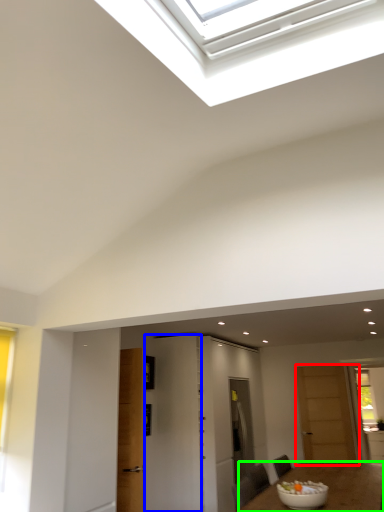
Question: Which object is the closest to the door (highlighted by a red box)? Choose among these: door (highlighted by a blue box) or table (highlighted by a green box).

Choices:
 (A) door
 (B) table

Answer: (B)